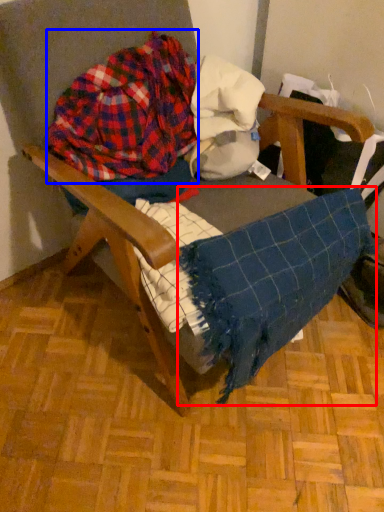
Question: Which object appears closest to the camera in this image, blanket (highlighted by a red box) or flannel (highlighted by a blue box)?

Choices:
 (A) blanket
 (B) flannel

Answer: (A)